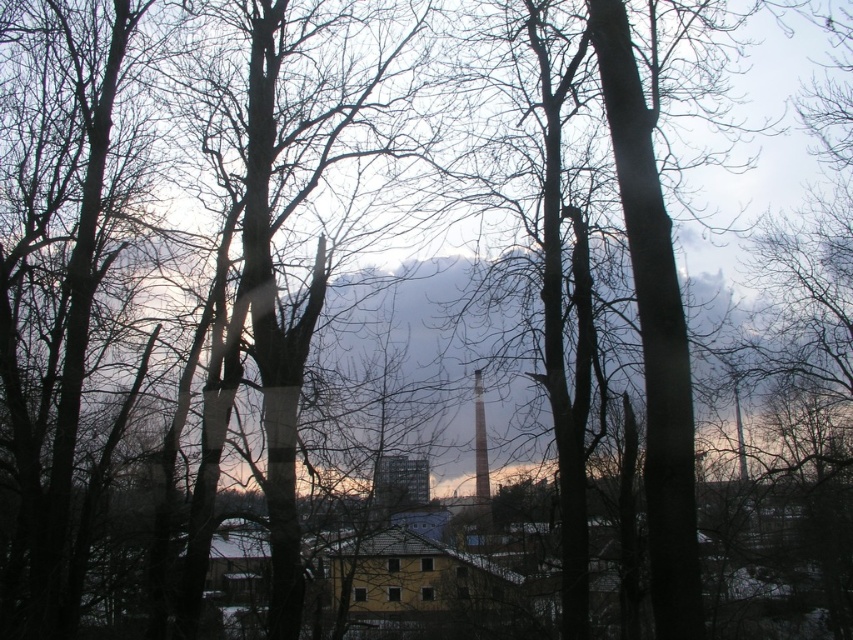
Question: Does smooth white tower at center have a greater width compared to smooth gray chimney at center?

Choices:
 (A) yes
 (B) no

Answer: (A)

Question: Which point appears farthest from the camera in this image?

Choices:
 (A) (479, 374)
 (B) (486, 509)

Answer: (B)

Question: Does smooth white tower at center lie behind smooth gray chimney at center?

Choices:
 (A) no
 (B) yes

Answer: (B)

Question: Is smooth white tower at center to the right of smooth gray chimney at center from the viewer's perspective?

Choices:
 (A) yes
 (B) no

Answer: (A)

Question: Which point is farther to the camera?

Choices:
 (A) smooth gray chimney at center
 (B) smooth white tower at center

Answer: (B)